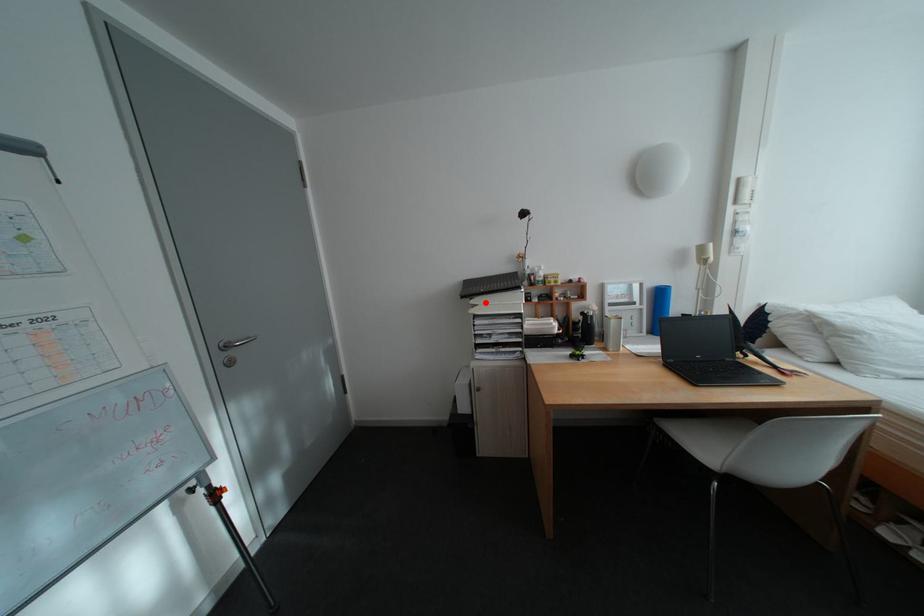
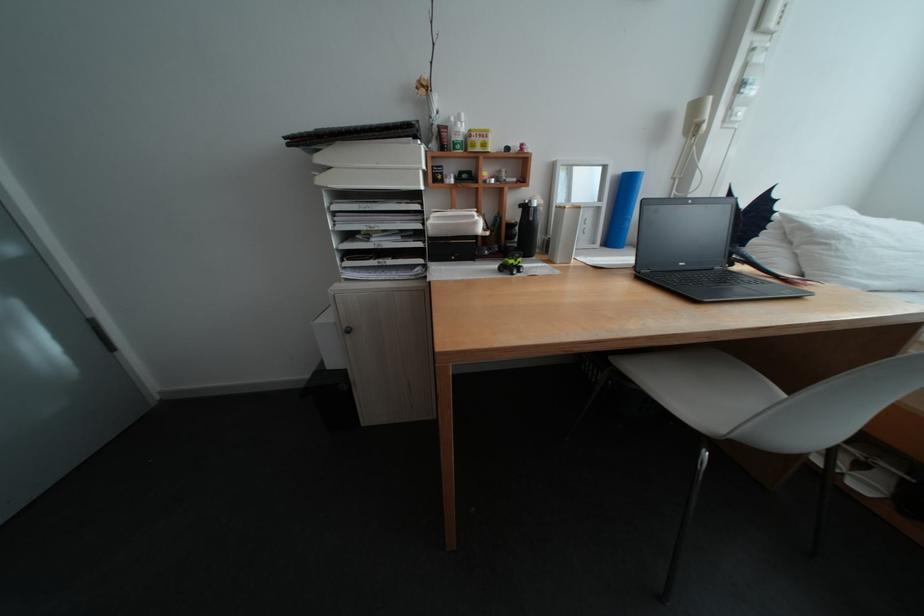
In the second image, find the point that corresponds to the highlighted location in the first image.

(333, 160)